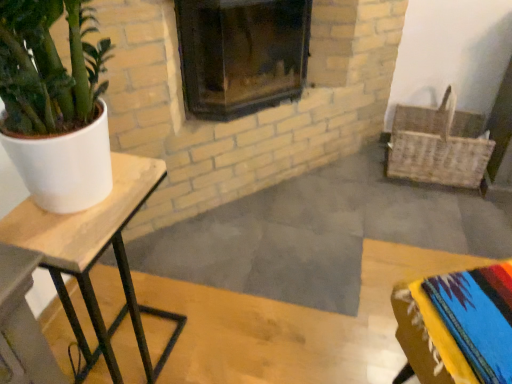
Question: From the image's perspective, is woven wicker basket at right positioned above or below wooden table at left?

Choices:
 (A) below
 (B) above

Answer: (B)

Question: Is woven wicker basket at right bigger or smaller than wooden table at left?

Choices:
 (A) big
 (B) small

Answer: (A)

Question: Considering the real-world distances, which object is farthest from the wooden table at left?

Choices:
 (A) woven wicker basket at right
 (B) dark glass fireplace at center

Answer: (A)

Question: Estimate the real-world distances between objects in this image. Which object is farther from the wooden table at left?

Choices:
 (A) dark glass fireplace at center
 (B) woven wicker basket at right

Answer: (B)